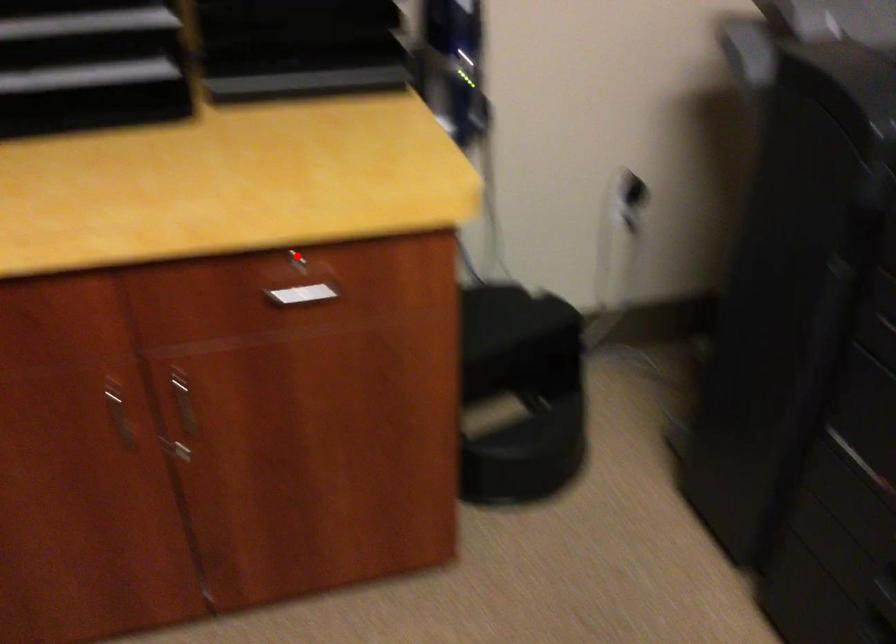
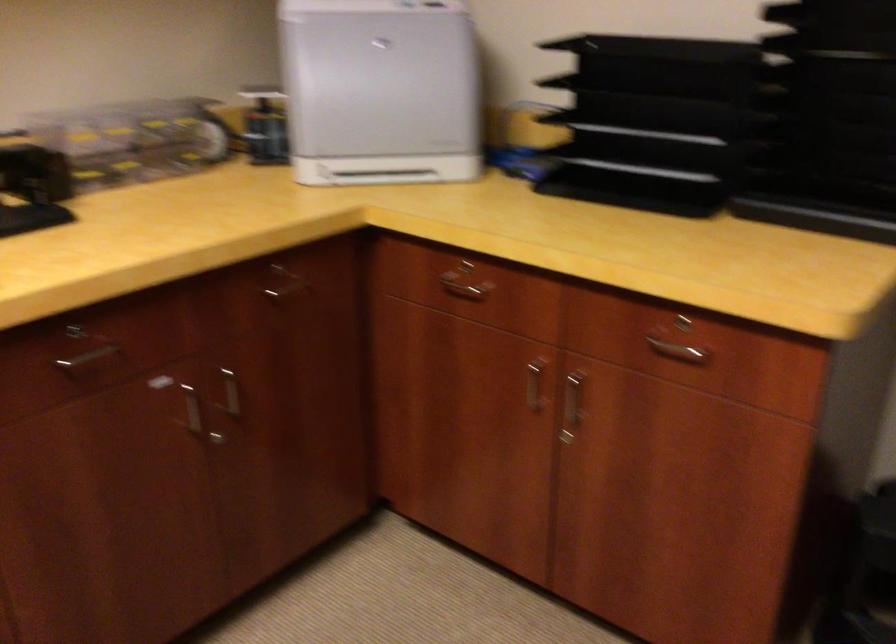
Find the pixel in the second image that matches the highlighted location in the first image.

(686, 321)